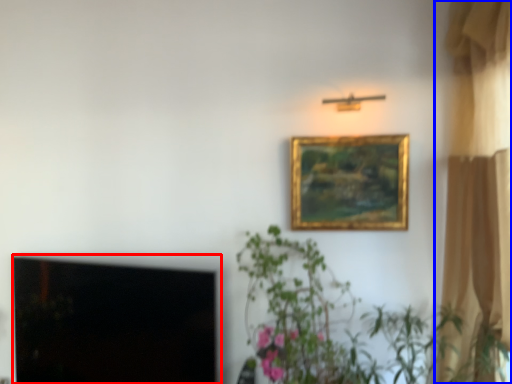
Question: Among these objects, which one is farthest to the camera, window screen (highlighted by a red box) or curtain (highlighted by a blue box)?

Choices:
 (A) window screen
 (B) curtain

Answer: (A)